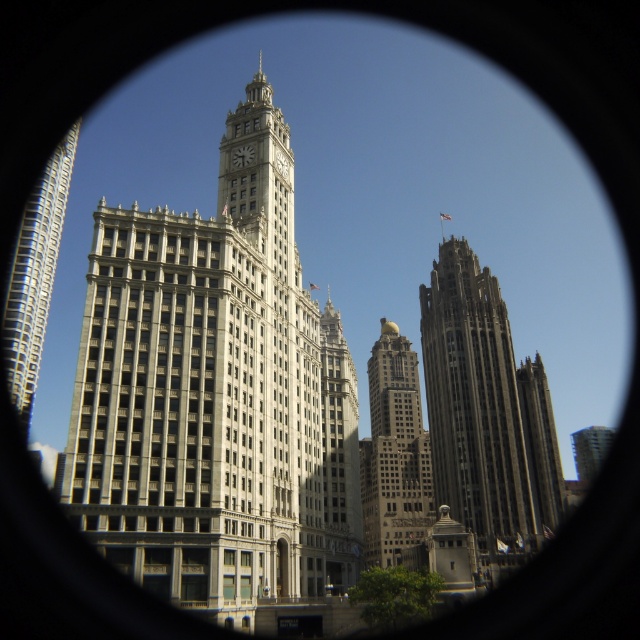
Question: Does dark gray stone tower at right come behind metallic glass skyscraper at center?

Choices:
 (A) yes
 (B) no

Answer: (B)

Question: Which point appears farthest from the camera in this image?

Choices:
 (A) (224, 481)
 (B) (582, 461)
 (C) (401, 440)
 (D) (541, 404)

Answer: (B)

Question: Which point appears closest to the camera in this image?

Choices:
 (A) (93, 525)
 (B) (582, 451)
 (C) (497, 467)
 (D) (419, 397)

Answer: (A)

Question: Can you confirm if dark gray stone tower at right is bigger than metallic glass skyscraper at center?

Choices:
 (A) no
 (B) yes

Answer: (A)

Question: Which point is farther from the camera taking this photo?

Choices:
 (A) (456, 330)
 (B) (592, 465)
 (C) (257, 80)

Answer: (B)

Question: Is dark gray stone tower at right closer to camera compared to metallic glass skyscraper at center?

Choices:
 (A) no
 (B) yes

Answer: (B)